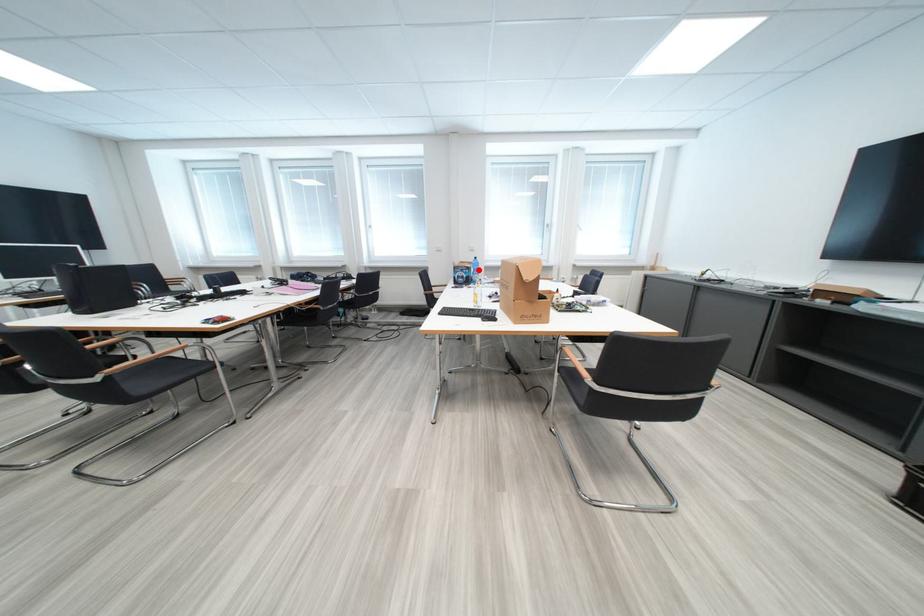
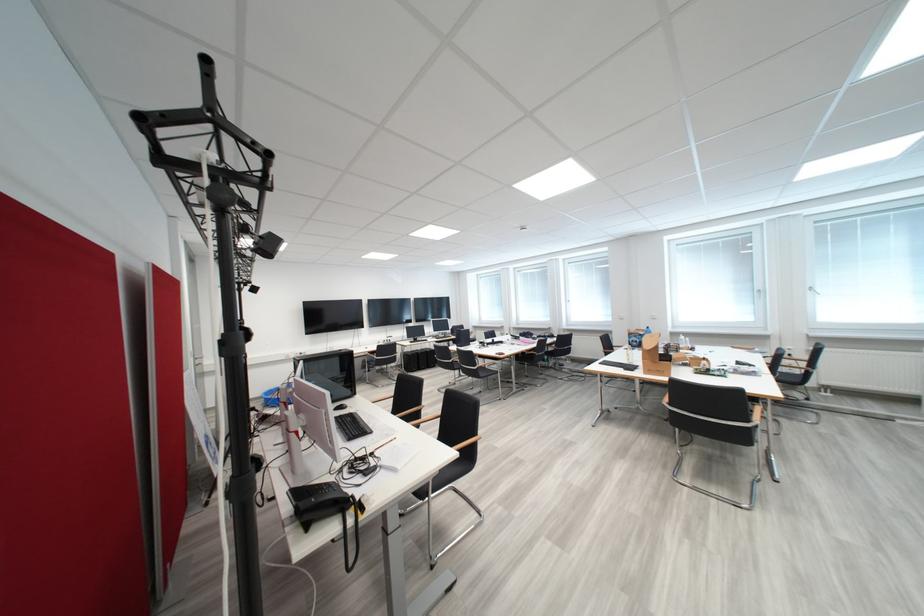
In the second image, find the point that corresponds to the highlighted location in the first image.

(650, 337)